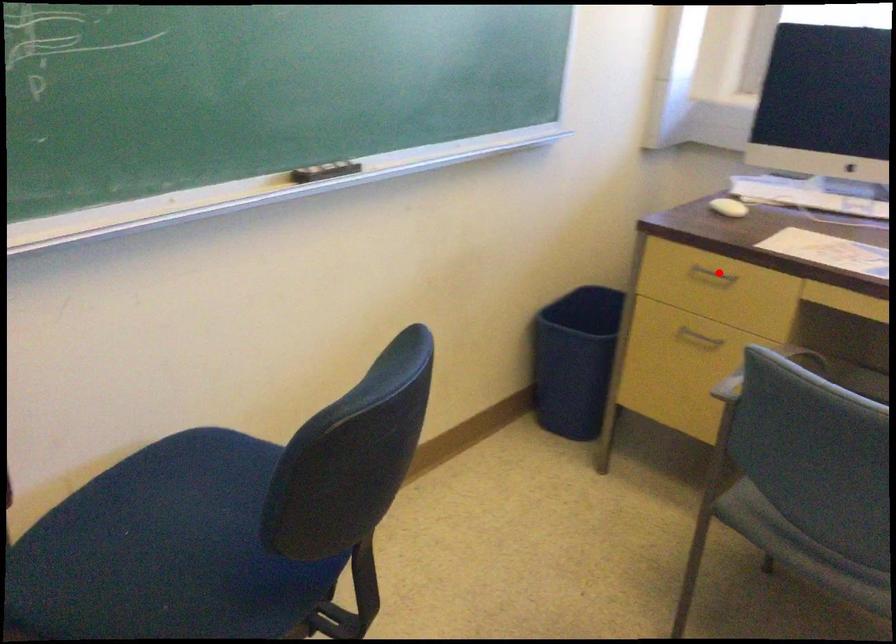
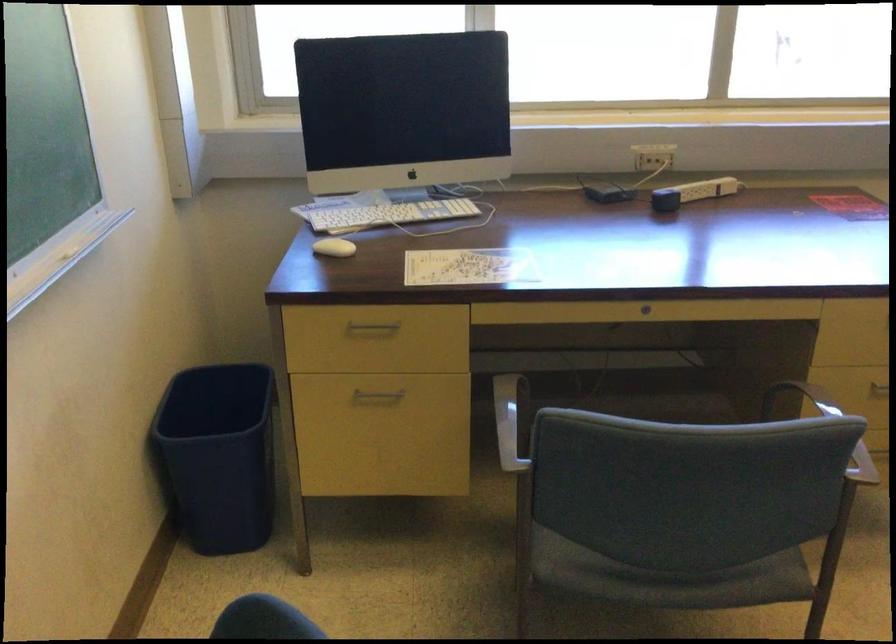
Find the pixel in the second image that matches the highlighted location in the first image.

(373, 327)